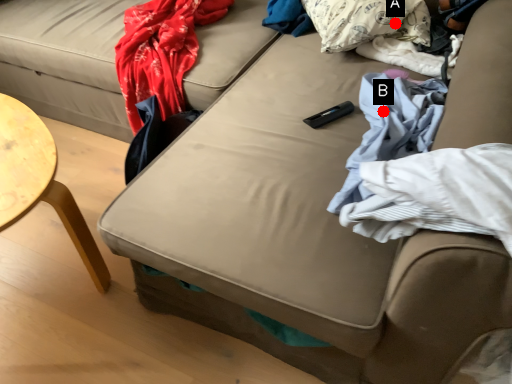
Question: Two points are circled on the image, labeled by A and B beside each circle. Which point is further to the camera?

Choices:
 (A) A is further
 (B) B is further

Answer: (A)